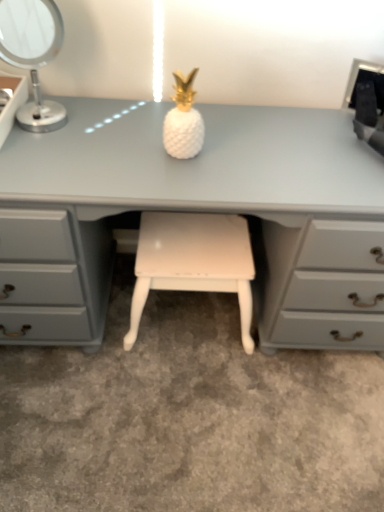
Locate an element on the screen. Image resolution: width=384 pixels, height=512 pixels. vacant area that lies between silver metallic table lamp at upper left and white glossy pineapple at center is located at coordinates (105, 137).